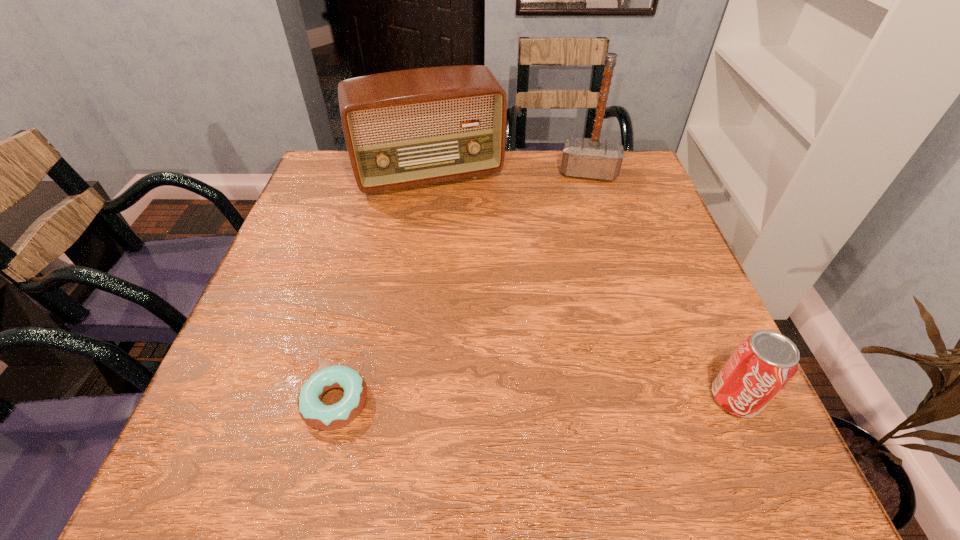
Where is `the shortest object`? the shortest object is located at coordinates (311, 409).

Image resolution: width=960 pixels, height=540 pixels. Find the location of `the rightmost object`. the rightmost object is located at coordinates (763, 363).

Locate an element on the screen. the third tallest object is located at coordinates (763, 363).

Locate an element on the screen. This screenshot has width=960, height=540. the third object from left to right is located at coordinates coord(582,157).

Identify the location of the tallest object. The height and width of the screenshot is (540, 960). (582, 157).

This screenshot has width=960, height=540. What are the coordinates of `the second tallest object` in the screenshot? It's located at (405, 128).

I want to click on free space located on the left of the doughnut, so (231, 402).

The width and height of the screenshot is (960, 540). In order to click on vacant position located on the left of the soda can in this screenshot , I will do `click(629, 398)`.

At what (x,y) coordinates should I click in order to perform the action: click on vacant space located on the striking surface of the tallest object. Please return your answer as a coordinate pair (x, y). Image resolution: width=960 pixels, height=540 pixels. Looking at the image, I should click on (583, 282).

Where is `vacant space situated 0.290m on the striking surface of the tallest object`? The image size is (960, 540). vacant space situated 0.290m on the striking surface of the tallest object is located at coordinates (584, 257).